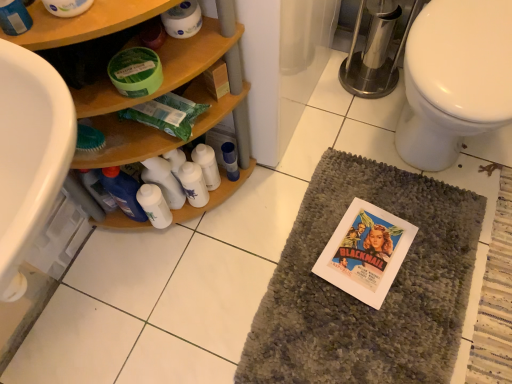
Identify the location of blank space situated above white paper comic book at center (from a real-world perspective). Image resolution: width=512 pixels, height=384 pixels. (367, 253).